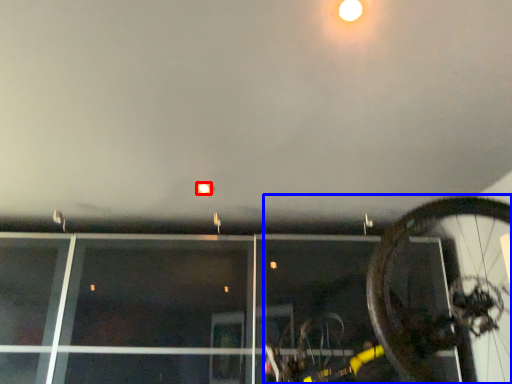
Question: Which point is closer to the camera, droplight (highlighted by a red box) or bicycle (highlighted by a blue box)?

Choices:
 (A) droplight
 (B) bicycle

Answer: (B)